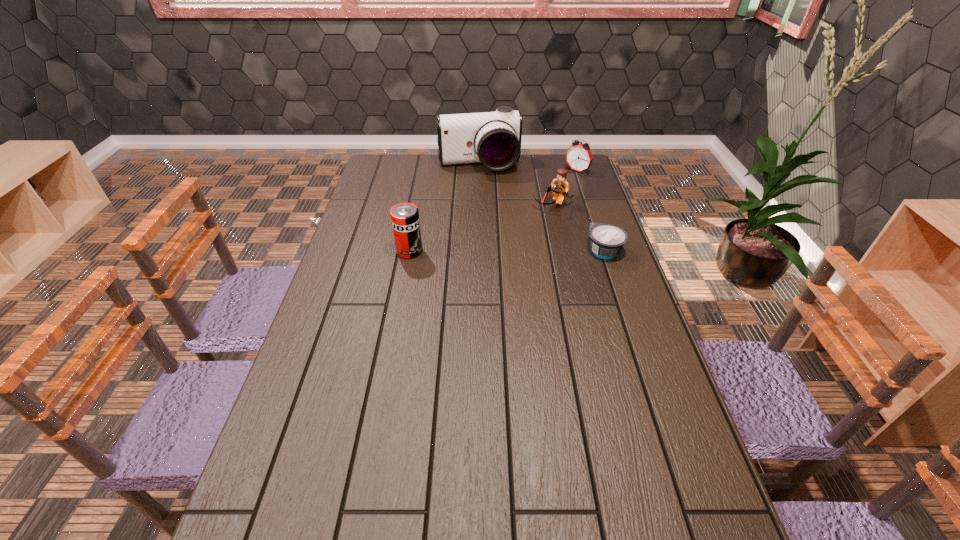
I want to click on the fourth shortest object, so click(x=405, y=220).

This screenshot has height=540, width=960. What are the coordinates of `the leftmost object` in the screenshot? It's located at (405, 220).

This screenshot has width=960, height=540. Identify the location of yogurt. (607, 240).

What are the coordinates of `Lego` in the screenshot? It's located at (560, 186).

Locate an element on the screen. This screenshot has width=960, height=540. alarm clock is located at coordinates (578, 157).

This screenshot has width=960, height=540. I want to click on camcorder, so click(492, 138).

The image size is (960, 540). In order to click on the second object from left to right in this screenshot , I will do `click(492, 138)`.

Locate an element on the screen. The width and height of the screenshot is (960, 540). free space located on the left of the can is located at coordinates (348, 251).

Identify the location of free spot located 0.170m on the left of the yogurt. This screenshot has width=960, height=540. [x=535, y=251].

Identify the location of free space located 0.250m holding a crossbow in the hands of the third farthest object. The height and width of the screenshot is (540, 960). point(516,249).